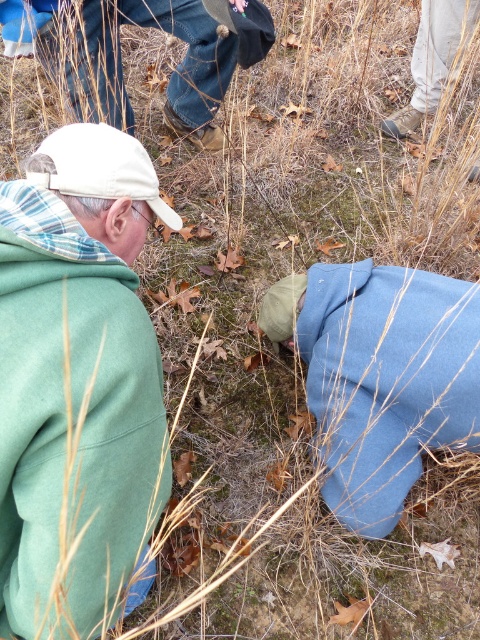
Locate an element on the screen. green fleece jacket at left is located at coordinates (78, 385).

Is point (46, 576) farther from viewer compared to point (261, 324)?

No, (46, 576) is closer to viewer.

The image size is (480, 640). I want to click on green fleece jacket at left, so click(x=78, y=385).

From the picture: Which is more to the left, blue fleece jacket at lower right or brown leather boots at upper center?

brown leather boots at upper center is more to the left.

The height and width of the screenshot is (640, 480). What do you see at coordinates (382, 376) in the screenshot?
I see `blue fleece jacket at lower right` at bounding box center [382, 376].

This screenshot has width=480, height=640. In order to click on blue fleece jacket at lower right in this screenshot , I will do `click(382, 376)`.

Is green fleece jacket at left thinner than brown leather boots at upper center?

Yes, green fleece jacket at left is thinner than brown leather boots at upper center.

Between green fleece jacket at left and brown leather boots at upper center, which one has more height?

Standing taller between the two is green fleece jacket at left.

Who is more distant from viewer, (79, 628) or (239, 20)?

The point (239, 20) is more distant.

Where is `green fleece jacket at left`? green fleece jacket at left is located at coordinates (78, 385).